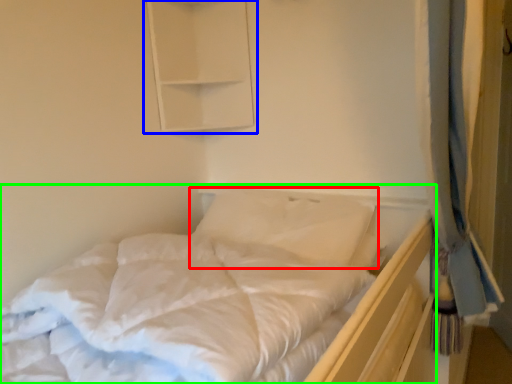
Question: Estimate the real-world distances between objects in this image. Which object is closer to pillow (highlighted by a red box), medicine cabinet (highlighted by a blue box) or bed (highlighted by a green box)?

Choices:
 (A) medicine cabinet
 (B) bed

Answer: (B)